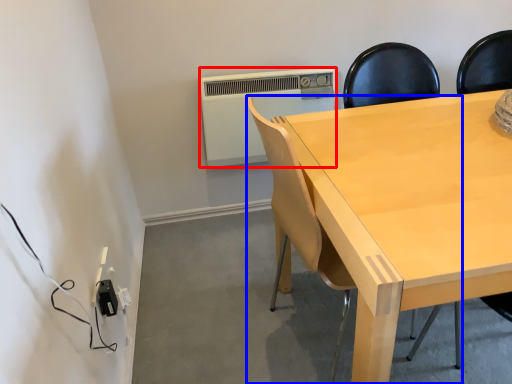
Question: Which point is further to the camera, air conditioning (highlighted by a red box) or chair (highlighted by a blue box)?

Choices:
 (A) air conditioning
 (B) chair

Answer: (A)